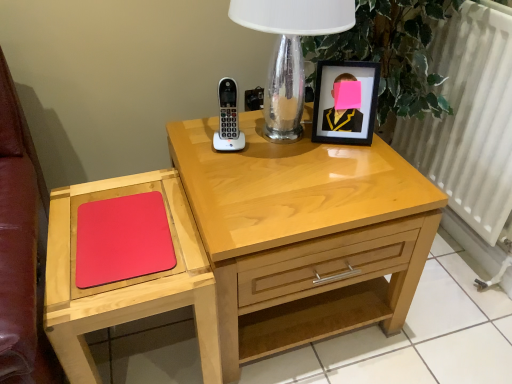
Question: Is point (106, 248) closer or farther from the camera than point (202, 321)?

Choices:
 (A) closer
 (B) farther

Answer: (A)

Question: From a real-world perspective, relative to matte wood mouse pad at left, is rubberized matte red mousepad at left vertically above or below?

Choices:
 (A) below
 (B) above

Answer: (B)

Question: Which object is positioned closest to the white plastic phone at center?

Choices:
 (A) light wood nightstand at center
 (B) rubberized matte red mousepad at left
 (C) clear glass table lamp at upper center
 (D) matte wood mouse pad at left
 (E) white metallic radiator at right

Answer: (C)

Question: Based on their relative distances, which object is nearer to the matte wood mouse pad at left?

Choices:
 (A) clear glass table lamp at upper center
 (B) rubberized matte red mousepad at left
 (C) light wood nightstand at center
 (D) white plastic phone at center
 (E) white metallic radiator at right

Answer: (B)